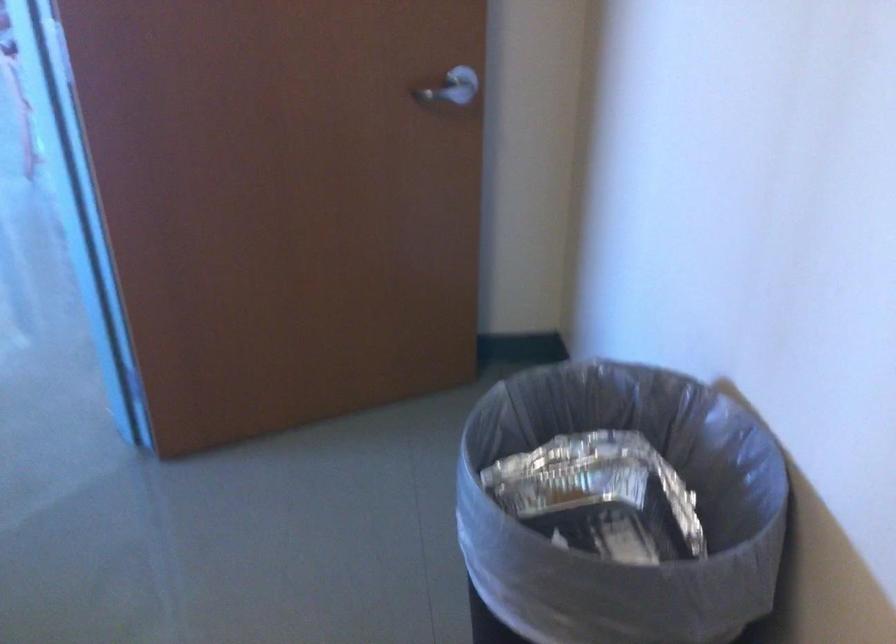
Question: The first image is from the beginning of the video and the second image is from the end. How did the camera likely rotate when shooting the video?

Choices:
 (A) Left
 (B) Right
 (C) Up
 (D) Down

Answer: (A)